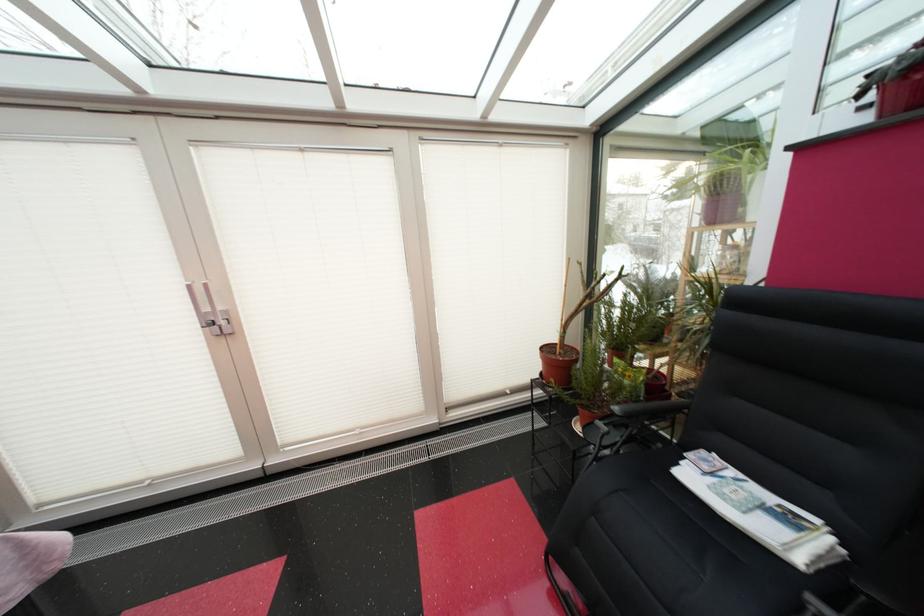
Where is `silver door handle`? The image size is (924, 616). silver door handle is located at coordinates (209, 310).